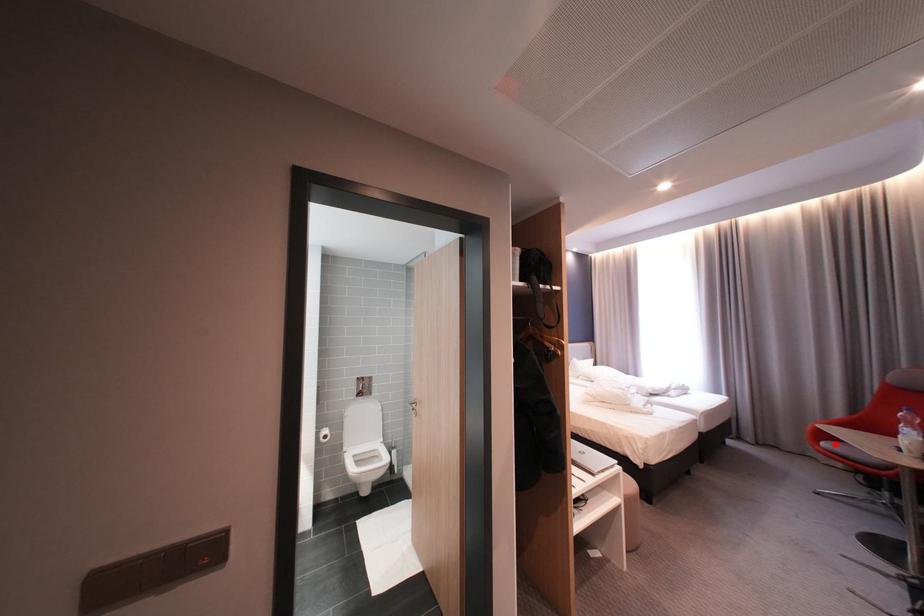
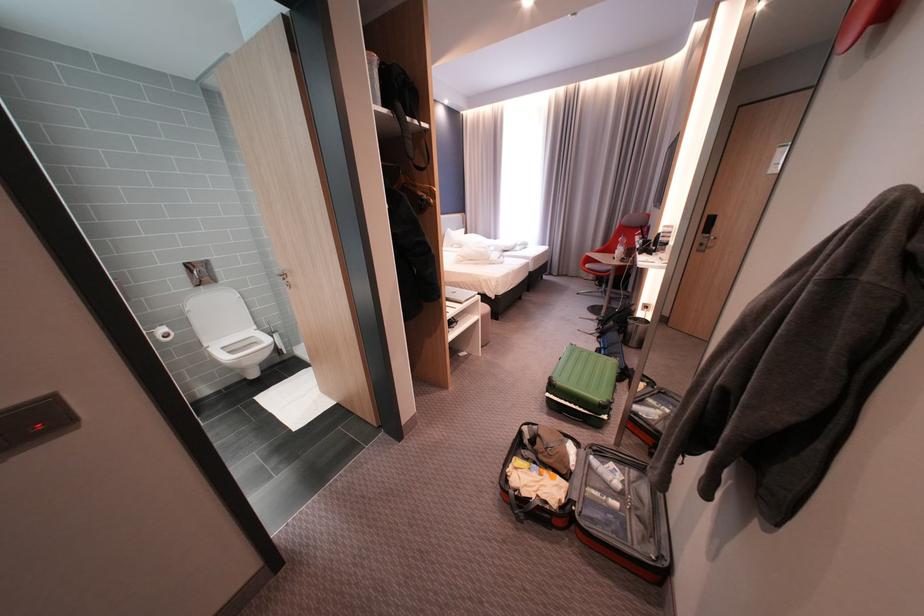
The point at the highlighted location is marked in the first image. Where is the corresponding point in the second image?

(598, 265)